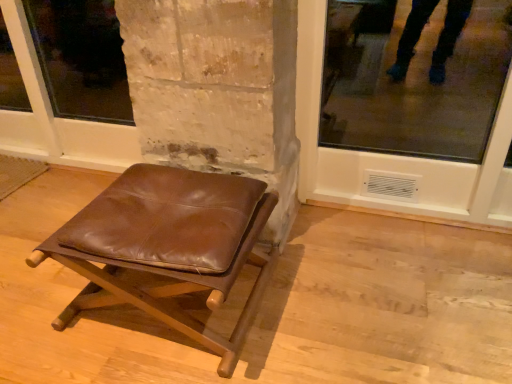
I want to click on vacant space in brown leather stool at center (from a real-world perspective), so click(180, 311).